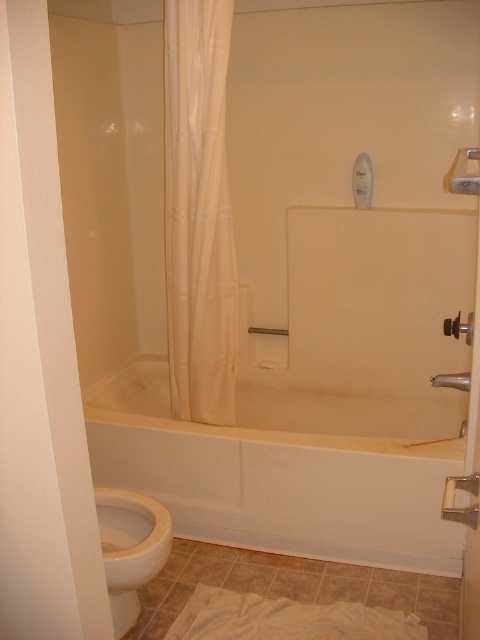
Is white fabric shower curtain at left wider than white glossy toilet bowl at lower left?

Incorrect, white fabric shower curtain at left's width does not surpass white glossy toilet bowl at lower left's.

Is white fabric shower curtain at left to the right of white glossy toilet bowl at lower left from the viewer's perspective?

Correct, you'll find white fabric shower curtain at left to the right of white glossy toilet bowl at lower left.

Image resolution: width=480 pixels, height=640 pixels. What are the coordinates of `white fabric shower curtain at left` in the screenshot? It's located at (199, 212).

Find the location of `white glossy bathtub at center`. white glossy bathtub at center is located at coordinates (287, 468).

Does white glossy bathtub at center appear under matte white shower at right?

Correct, white glossy bathtub at center is located below matte white shower at right.

The height and width of the screenshot is (640, 480). What do you see at coordinates (287, 468) in the screenshot? I see `white glossy bathtub at center` at bounding box center [287, 468].

Locate an element on the screen. The width and height of the screenshot is (480, 640). white glossy bathtub at center is located at coordinates (287, 468).

Does white glossy toilet bowl at lower left have a lesser width compared to matte white shower at right?

No, white glossy toilet bowl at lower left is not thinner than matte white shower at right.

Is white glossy toilet bowl at lower left positioned in front of matte white shower at right?

No, it is behind matte white shower at right.

Who is more forward, (116, 540) or (456, 387)?

Point (456, 387)

The image size is (480, 640). What are the coordinates of `white glossy toilet bowl at lower left` in the screenshot? It's located at (130, 548).